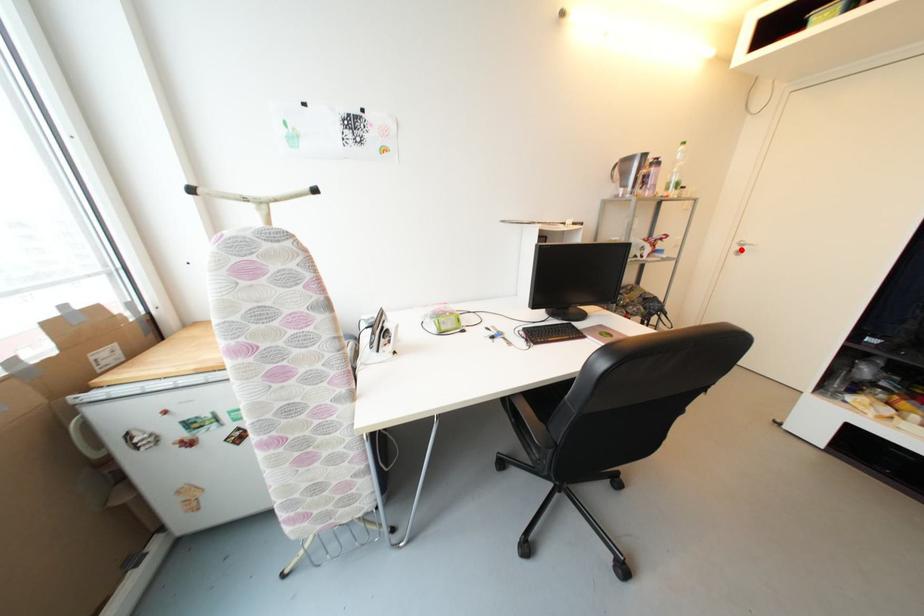
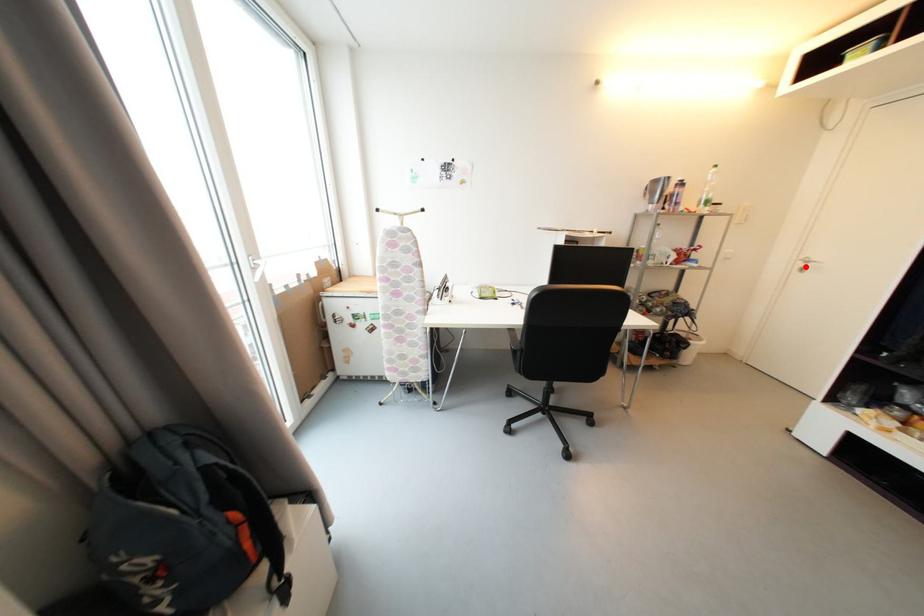
I am providing you with two images of the same scene from different viewpoints. A red point is marked on the first image and another point is marked on the second image. Is the red point in image1 aligned with the point shown in image2?

Yes